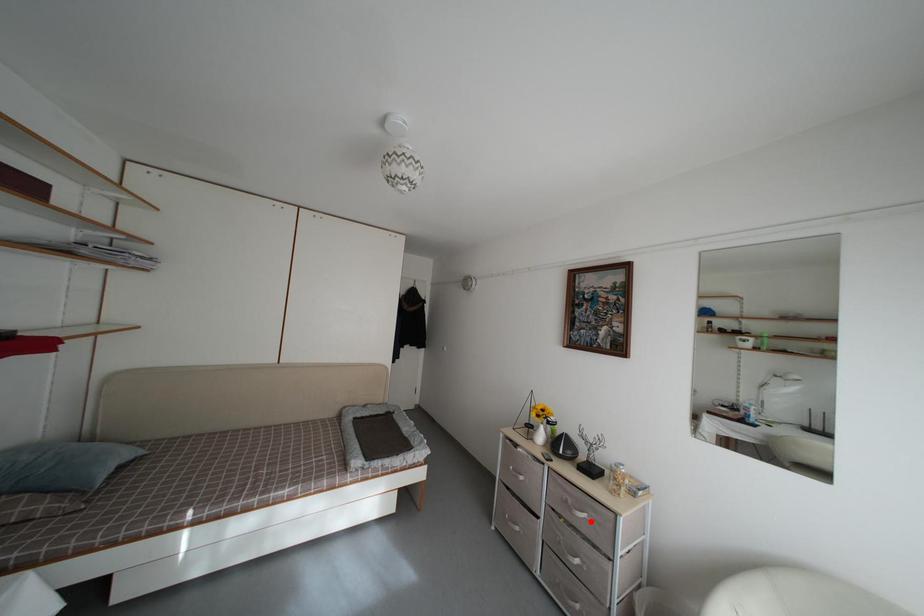
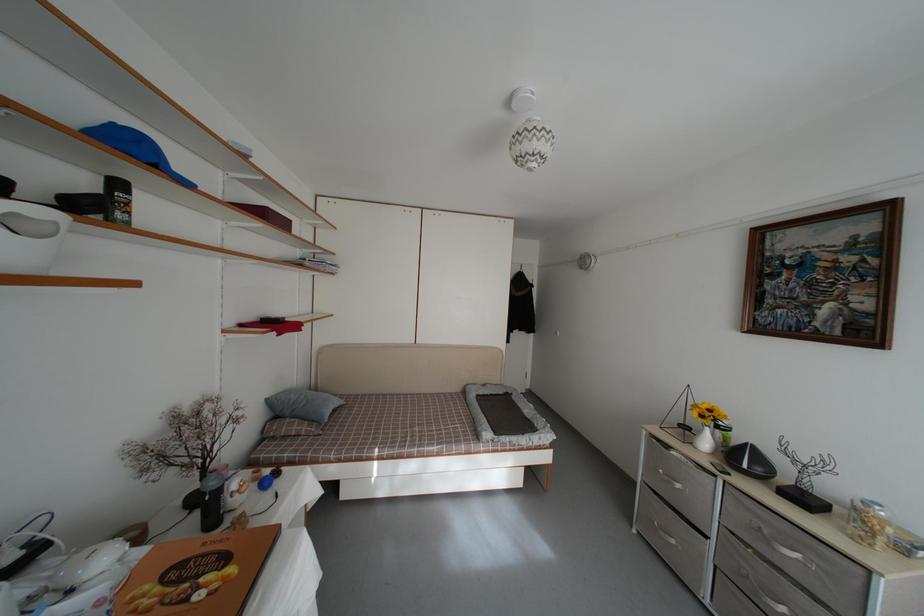
In the second image, find the point that corresponds to the highlighted location in the first image.

(804, 562)